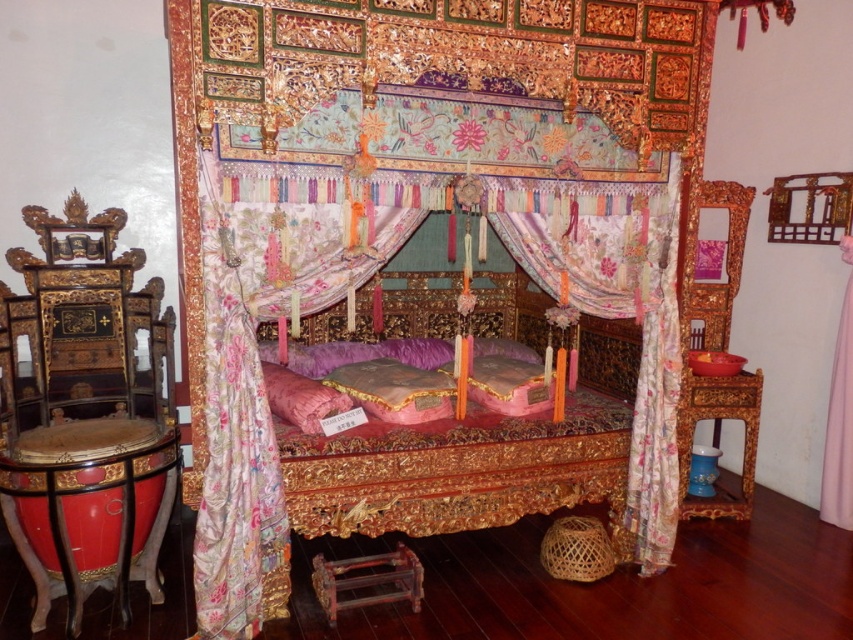
Based on the photo, is glossy wood chair at left to the left of floral silk curtain at right from the viewer's perspective?

Correct, you'll find glossy wood chair at left to the left of floral silk curtain at right.

Is glossy wood chair at left positioned before floral silk curtain at right?

Yes, glossy wood chair at left is in front of floral silk curtain at right.

Is point (39, 625) positioned behind point (641, 544)?

No, (39, 625) is in front of (641, 544).

Identify the location of glossy wood chair at left. Image resolution: width=853 pixels, height=640 pixels. (85, 412).

Is the position of gold-carved canopy bed at center less distant than that of silky floral curtain at center?

Yes, it is.

Which is behind, point (544, 36) or point (248, 596)?

The point (544, 36) is behind.

The width and height of the screenshot is (853, 640). I want to click on gold-carved canopy bed at center, so click(379, 212).

Between point (210, 250) and point (851, 406), which one is positioned in front?

Point (210, 250) is more forward.

Between silky floral curtain at center and pink satin curtain at right, which one appears on the left side from the viewer's perspective?

From the viewer's perspective, silky floral curtain at center appears more on the left side.

Consider the image. Who is more distant from viewer, (215, 308) or (845, 477)?

Point (845, 477)

You are a GUI agent. You are given a task and a screenshot of the screen. Output one action in this format:
    pyautogui.click(x=<x>, y=<y>)
    Task: Click on the silky floral curtain at center
    
    Given the screenshot: What is the action you would take?
    pyautogui.click(x=236, y=428)